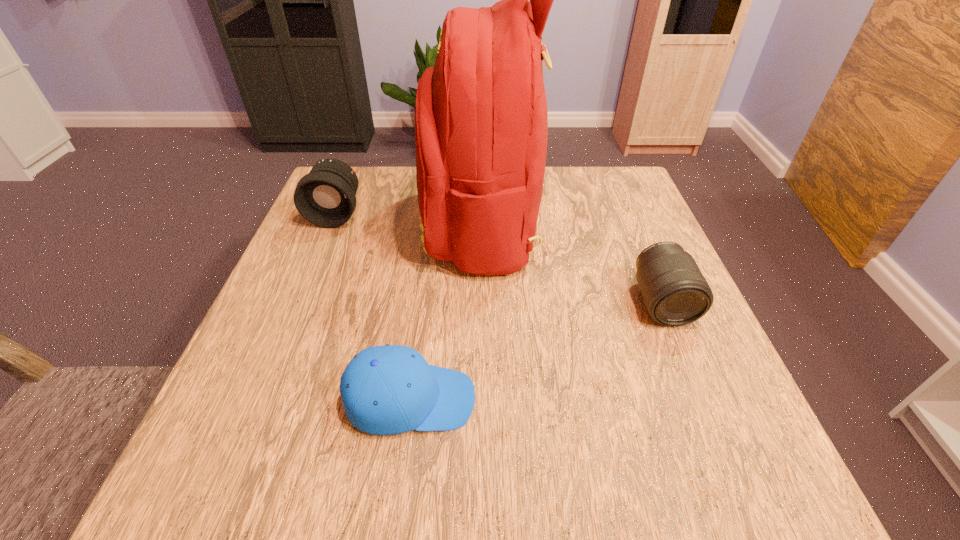
What are the coordinates of `vacant space situated 0.200m on the surface of the shorter telephoto lens` in the screenshot? It's located at (715, 431).

The image size is (960, 540). What are the coordinates of `free space located 0.050m on the front-facing side of the nearest object` in the screenshot? It's located at (506, 399).

Find the location of a particular element. backpack that is at the far edge is located at coordinates (481, 121).

You are a GUI agent. You are given a task and a screenshot of the screen. Output one action in this format:
    pyautogui.click(x=<x>, y=<y>)
    Task: Click on the telephoto lens that is at the far edge
    This screenshot has width=960, height=540.
    Given the screenshot: What is the action you would take?
    pyautogui.click(x=325, y=196)

The height and width of the screenshot is (540, 960). I want to click on object positioned at the near edge, so click(x=390, y=389).

I want to click on object present at the left edge, so click(325, 196).

The width and height of the screenshot is (960, 540). In order to click on object that is at the right edge in this screenshot , I will do `click(675, 293)`.

Where is `object present at the far left corner`? object present at the far left corner is located at coordinates (325, 196).

Where is `vacant space at the far edge`? This screenshot has width=960, height=540. vacant space at the far edge is located at coordinates (567, 171).

You are a GUI agent. You are given a task and a screenshot of the screen. Output one action in this format:
    pyautogui.click(x=<x>, y=<y>)
    Task: Click on the blank space at the near edge
    The image size is (960, 540).
    Given the screenshot: What is the action you would take?
    pyautogui.click(x=558, y=462)